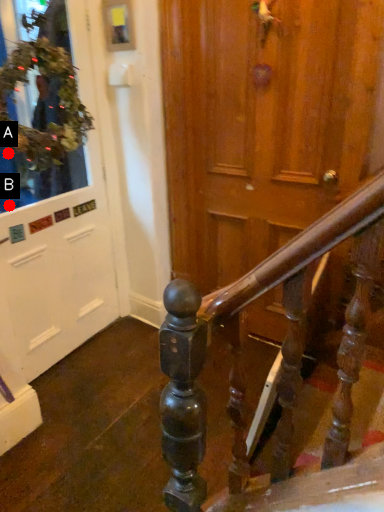
Question: Two points are circled on the image, labeled by A and B beside each circle. Which of the following is the farthest from the observer?

Choices:
 (A) A is further
 (B) B is further

Answer: (A)